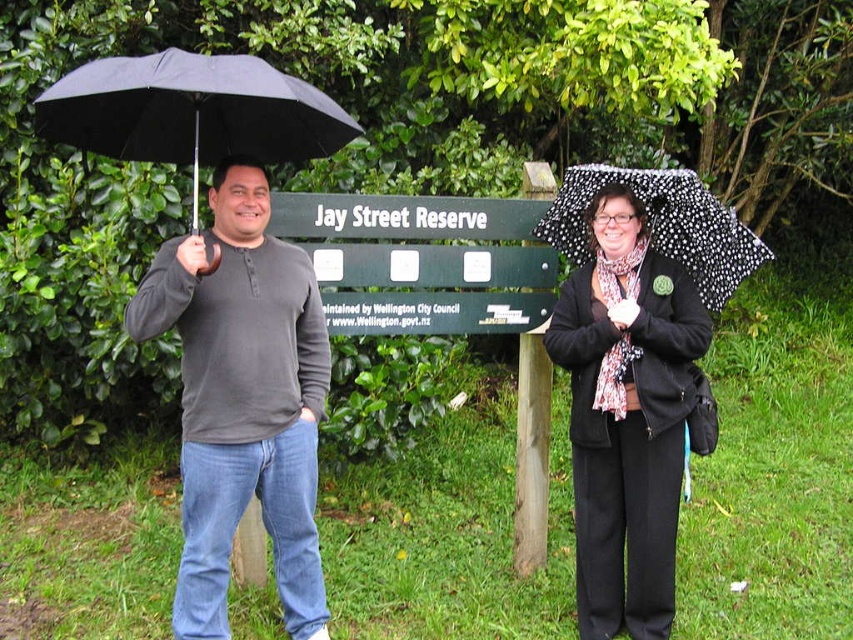
Is black matte umbrella at left positioned in front of black dotted umbrella at upper right?

Yes, black matte umbrella at left is in front of black dotted umbrella at upper right.

Measure the distance between black matte umbrella at left and black dotted umbrella at upper right.

5.22 feet

Find the location of a particular element. black matte umbrella at left is located at coordinates (190, 112).

Does dark gray henley shirt at left have a lesser height compared to black dotted umbrella at upper right?

No, dark gray henley shirt at left is not shorter than black dotted umbrella at upper right.

Can you confirm if dark gray henley shirt at left is positioned to the left of black dotted umbrella at upper right?

Correct, you'll find dark gray henley shirt at left to the left of black dotted umbrella at upper right.

Does point (287, 460) lie behind point (670, 186)?

No, (287, 460) is in front of (670, 186).

Image resolution: width=853 pixels, height=640 pixels. I want to click on dark gray henley shirt at left, so click(x=242, y=401).

Can you confirm if black woolen jacket at center is smaller than black dotted umbrella at upper right?

No, black woolen jacket at center is not smaller than black dotted umbrella at upper right.

Does point (573, 396) come closer to viewer compared to point (680, 211)?

Yes, it is.

Between point (556, 353) and point (550, 228), which one is positioned in front?

Point (556, 353) is more forward.

You are a GUI agent. You are given a task and a screenshot of the screen. Output one action in this format:
    pyautogui.click(x=<x>, y=<y>)
    Task: Click on the black woolen jacket at center
    
    Given the screenshot: What is the action you would take?
    tap(625, 413)